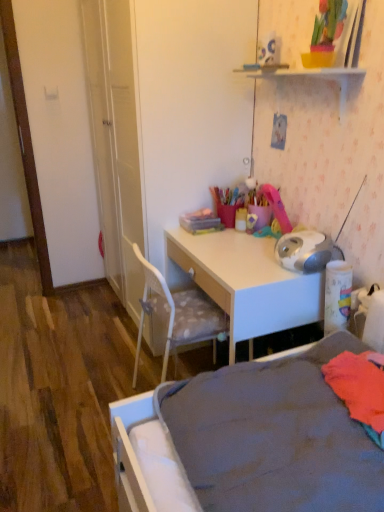
Question: Relative to gray fabric bed at lower right, is white glossy desk at center in front or behind?

Choices:
 (A) front
 (B) behind

Answer: (B)

Question: Looking at their shapes, would you say white glossy desk at center is wider or thinner than gray fabric bed at lower right?

Choices:
 (A) wide
 (B) thin

Answer: (B)

Question: Which object is positioned closest to the white glossy desk at center?

Choices:
 (A) gray fabric bed at lower right
 (B) white plastic shelf at upper center

Answer: (A)

Question: Which is farther from the white plastic shelf at upper center?

Choices:
 (A) gray fabric bed at lower right
 (B) white glossy desk at center

Answer: (A)